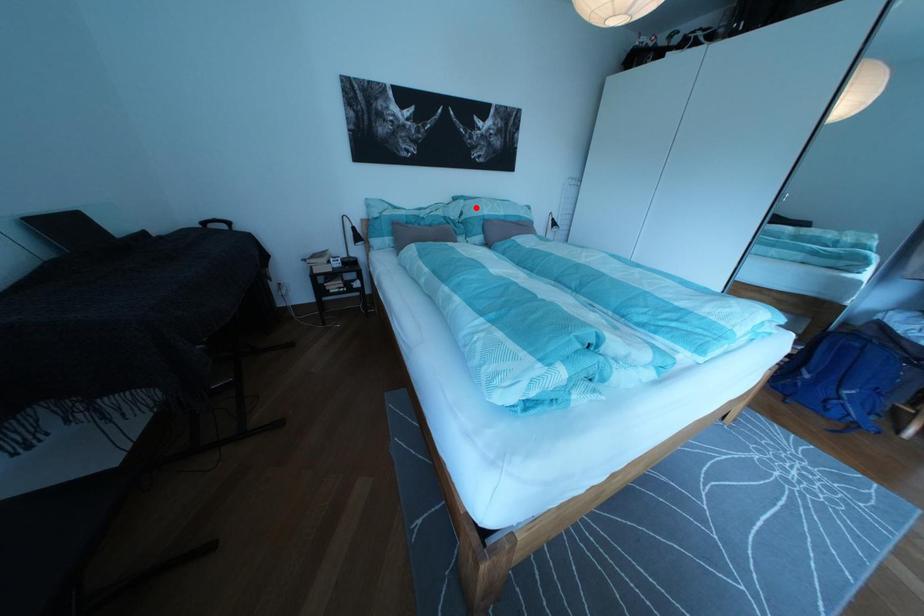
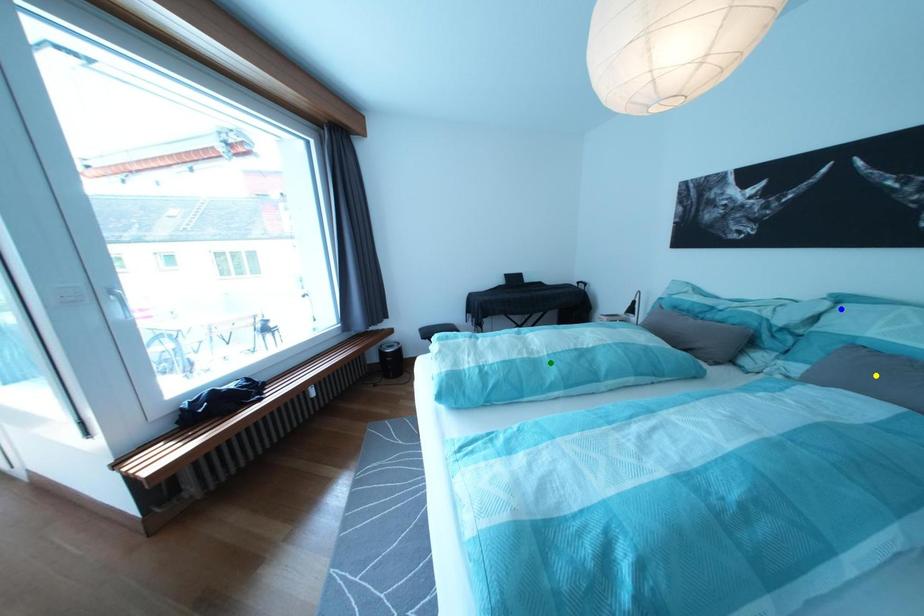
Question: I am providing you with two images of the same scene from different viewpoints. A red point is marked on the first image. You are given multiple points on the second image. Which point in image 2 is actually the same real-world point as the red point in image 1?

Choices:
 (A) green point
 (B) yellow point
 (C) blue point

Answer: (C)